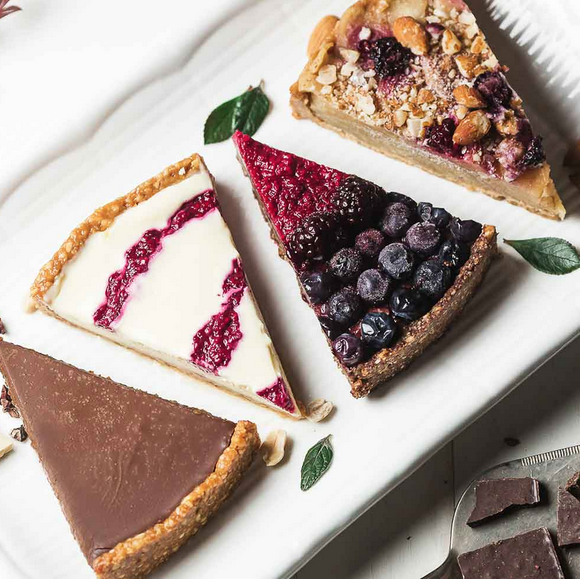
Find the location of a particular element. The height and width of the screenshot is (582, 582). sprigs of mint on plate is located at coordinates (315, 466), (255, 110), (214, 118), (544, 259).